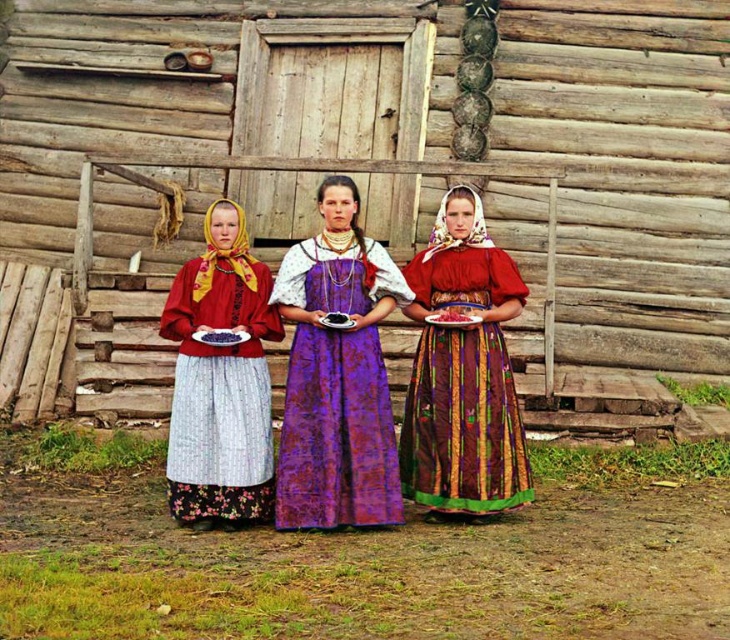
In the scene shown: You are a photographer standing in front of the rustic wooden cabin. You notice the matte red dress at center and the red glossy plate at center. Which object is nearer to you?

The matte red dress at center is closer to the viewer than the red glossy plate at center.

Based on the scene description, where is the matte red dress at center located in the image?

The matte red dress at center is located at the 2D coordinates point (464, 371).

You are a photographer taking a picture of the matte red dress at center and the red glossy plate at center. Which object should you focus on first if you want the dress to be in sharp focus while the plate is slightly blurred?

You should focus on the matte red dress at center first because it is positioned under the red glossy plate at center, so focusing on the dress will keep it sharp while the plate might be slightly out of focus depending on the depth of field.